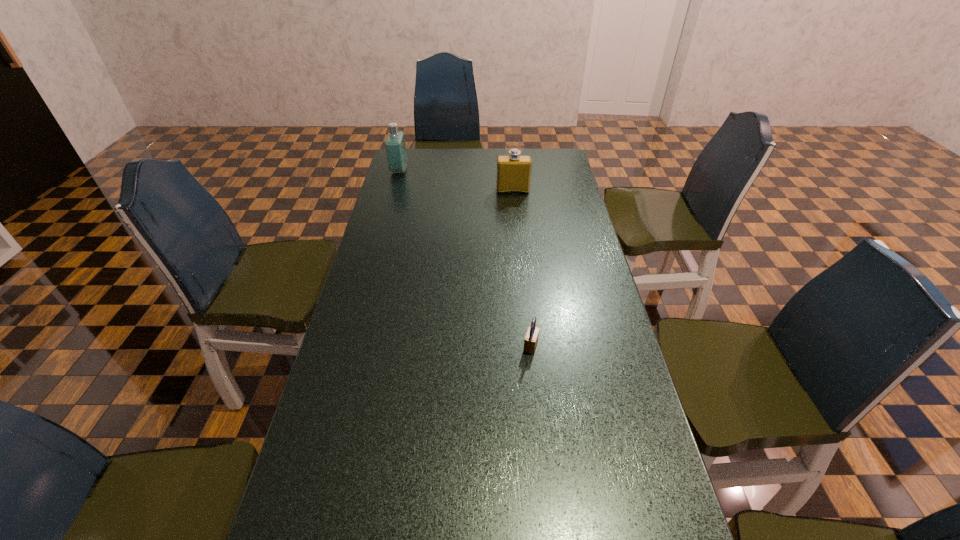
Find the location of a particular element. The image size is (960, 540). the left perfume is located at coordinates (395, 145).

This screenshot has height=540, width=960. In order to click on the leftmost object in this screenshot , I will do `click(395, 145)`.

The width and height of the screenshot is (960, 540). In order to click on the right perfume in this screenshot , I will do `click(513, 171)`.

Identify the location of the nearer perfume. (513, 171).

You are a GUI agent. You are given a task and a screenshot of the screen. Output one action in this format:
    pyautogui.click(x=<x>, y=<y>)
    Task: Click on the nearest object
    Image resolution: width=960 pixels, height=540 pixels.
    Given the screenshot: What is the action you would take?
    pyautogui.click(x=531, y=339)

Image resolution: width=960 pixels, height=540 pixels. I want to click on padlock, so click(x=531, y=339).

Locate an element on the screen. This screenshot has width=960, height=540. vacant point located 0.210m on the front label of the farther perfume is located at coordinates (457, 171).

This screenshot has width=960, height=540. In order to click on free point located 0.210m on the front-facing side of the right perfume in this screenshot , I will do `click(516, 226)`.

This screenshot has height=540, width=960. Find the location of `free space located 0.400m on the left of the shortest object`. free space located 0.400m on the left of the shortest object is located at coordinates (371, 346).

Where is `object that is at the far edge`? The height and width of the screenshot is (540, 960). object that is at the far edge is located at coordinates (395, 145).